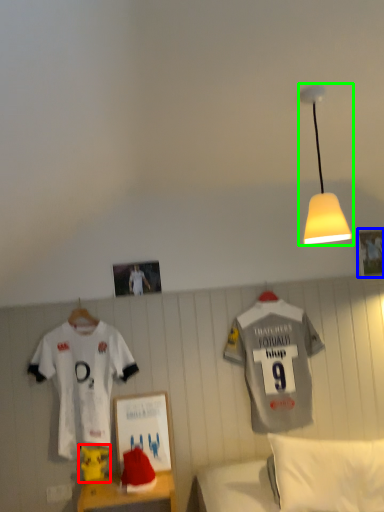
Question: Considering the real-world distances, which object is farthest from toy (highlighted by a red box)? picture frame (highlighted by a blue box) or lamp (highlighted by a green box)?

Choices:
 (A) picture frame
 (B) lamp

Answer: (A)